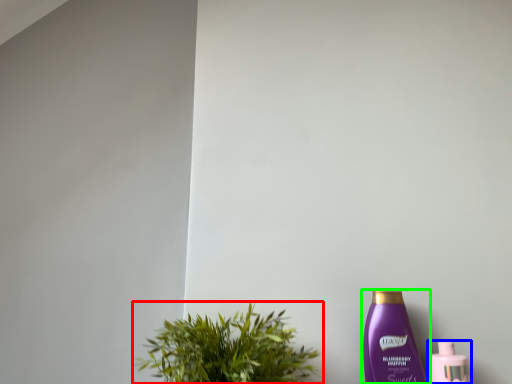
Question: Which is nearer to the houseplant (highlighted by a red box)? bottle (highlighted by a blue box) or bottle (highlighted by a green box).

Choices:
 (A) bottle
 (B) bottle

Answer: (B)